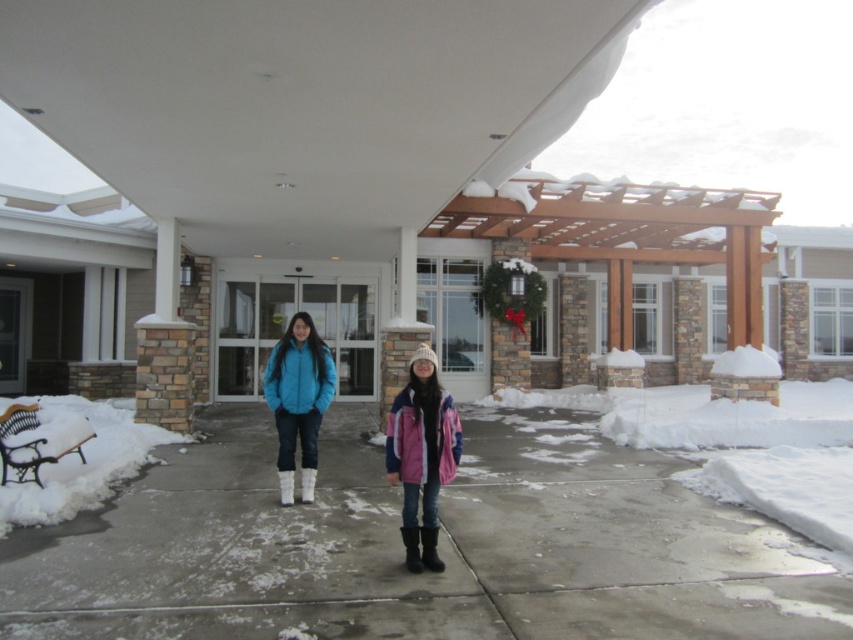
You are a delivery person trying to place a package on the ground in front of the entrance. The package is too heavy to lift high. You see the concrete pavement at center and the pink fleece jacket at center. Which surface can you place the package on without lifting it high?

The concrete pavement at center is below the pink fleece jacket at center, so you can place the package on the concrete pavement at center without needing to lift it high.

You are planning to walk across the area where the concrete pavement at center and the pink fleece jacket at center are located. Considering their sizes, which one do you think will require more space when you step on them?

The concrete pavement at center has a larger width than the pink fleece jacket at center, so stepping on the concrete pavement at center will require more space.